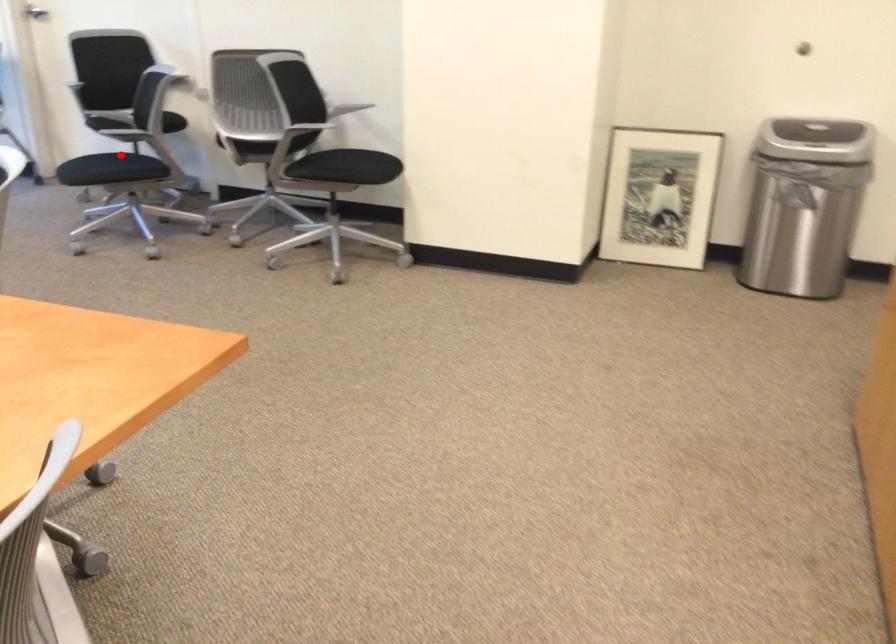
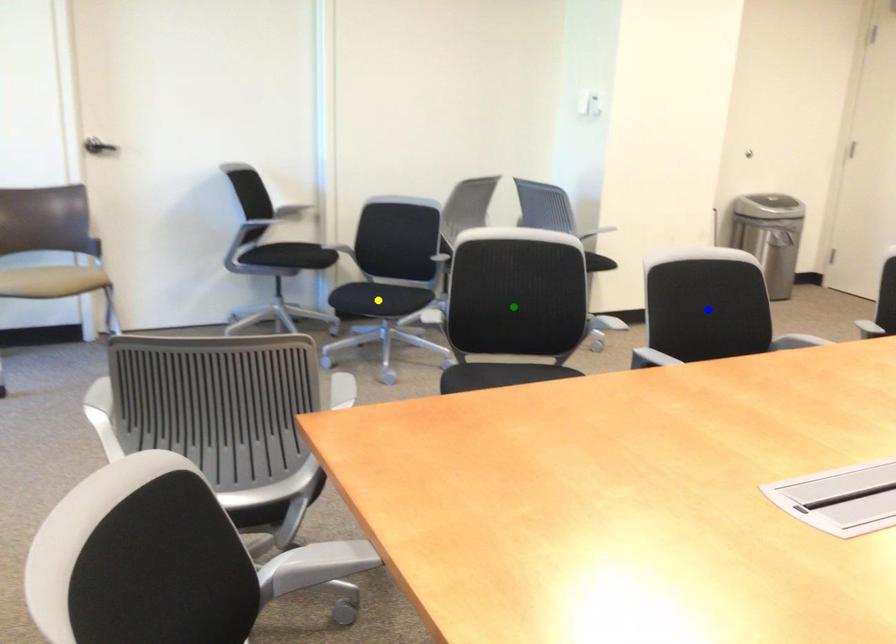
Question: I am providing you with two images of the same scene from different viewpoints. A red point is marked on the first image. You are given multiple points on the second image. Which point in image 2 is actually the same real-world point as the red point in image 1?

Choices:
 (A) blue point
 (B) yellow point
 (C) green point

Answer: (B)